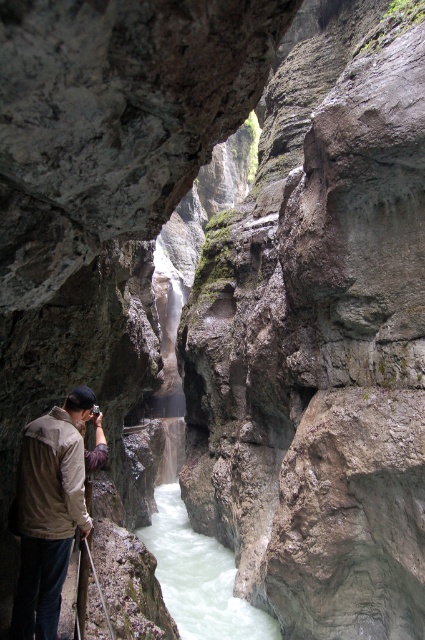
Is point (61, 529) behind point (169, 605)?

No, (61, 529) is in front of (169, 605).

Is tan fabric jacket at lower left to the right of white frothy water at center from the viewer's perspective?

Incorrect, tan fabric jacket at lower left is not on the right side of white frothy water at center.

Which is behind, point (59, 552) or point (176, 536)?

Positioned behind is point (176, 536).

Locate an element on the screen. This screenshot has height=640, width=425. tan fabric jacket at lower left is located at coordinates (50, 512).